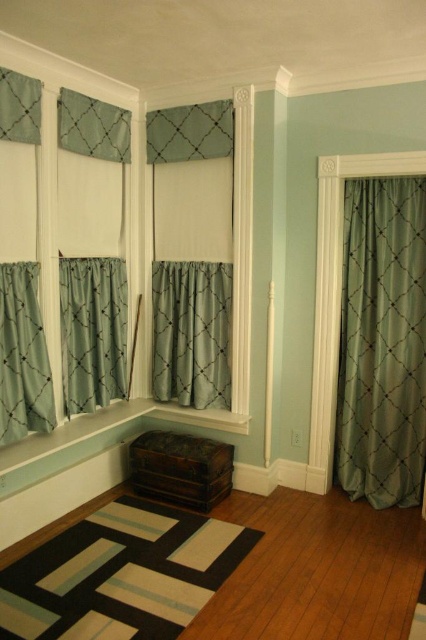
Who is shorter, green silk curtain at right or satin teal curtain at center?

With less height is satin teal curtain at center.

Is point (365, 364) in front of point (173, 164)?

Yes, point (365, 364) is in front of point (173, 164).

Identify the location of green silk curtain at right. (382, 342).

Find the location of a particular element. The height and width of the screenshot is (640, 426). green silk curtain at right is located at coordinates (382, 342).

Between satin teal curtain at center and matte teal curtain at center, which one appears on the left side from the viewer's perspective?

Positioned to the left is matte teal curtain at center.

Does satin teal curtain at center have a greater height compared to matte teal curtain at center?

Yes, satin teal curtain at center is taller than matte teal curtain at center.

Which is in front, point (222, 148) or point (155, 376)?

Point (222, 148)

The height and width of the screenshot is (640, 426). Identify the location of satin teal curtain at center. (190, 248).

Who is taller, green silk curtain at right or matte teal curtain at upper left?

green silk curtain at right

Between green silk curtain at right and matte teal curtain at upper left, which one is positioned lower?

Positioned lower is green silk curtain at right.

Is point (393, 304) in front of point (69, 416)?

No, it is not.

Where is `green silk curtain at right`? The height and width of the screenshot is (640, 426). green silk curtain at right is located at coordinates (382, 342).